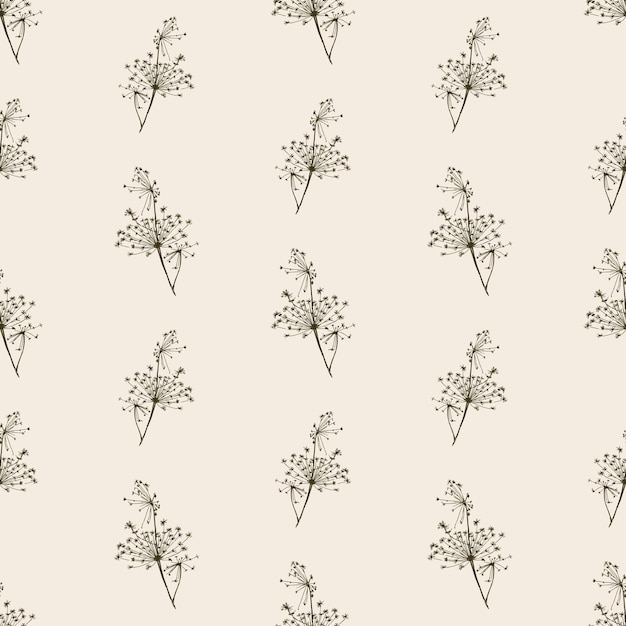
Where is `wall paper decorations`? wall paper decorations is located at coordinates (478, 380), (475, 235), (321, 319), (320, 165).